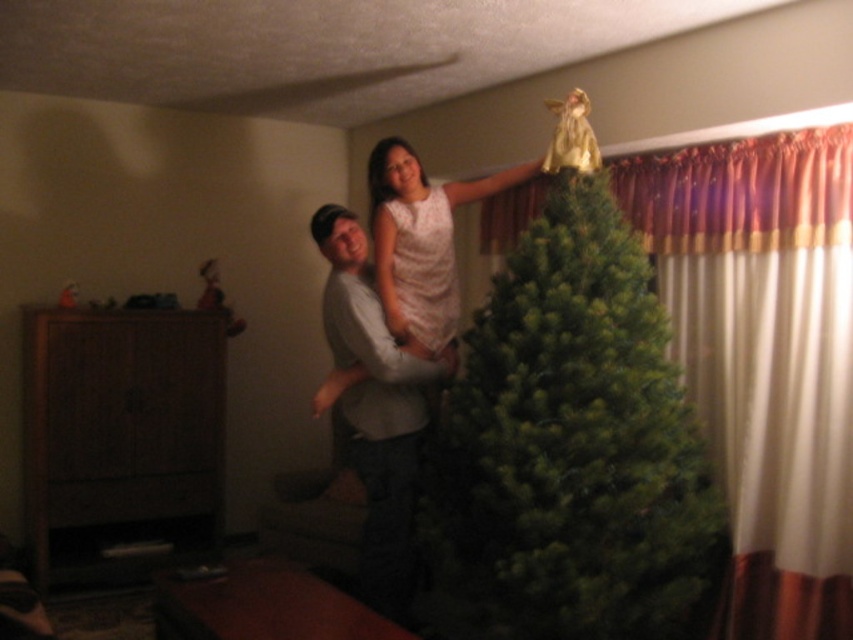
Question: Among these points, which one is nearest to the camera?

Choices:
 (A) (407, 230)
 (B) (367, 352)
 (C) (498, 317)

Answer: (B)

Question: Does gray cotton shirt at center have a greater width compared to white lace dress at center?

Choices:
 (A) no
 (B) yes

Answer: (A)

Question: Which point appears farthest from the camera in this image?

Choices:
 (A) (329, 316)
 (B) (381, 214)

Answer: (B)

Question: Does green matte christmas tree at center have a greater width compared to gray cotton shirt at center?

Choices:
 (A) yes
 (B) no

Answer: (A)

Question: Can you confirm if green matte christmas tree at center is positioned below gray cotton shirt at center?

Choices:
 (A) no
 (B) yes

Answer: (A)

Question: Which point is closer to the camera?

Choices:
 (A) (393, 488)
 (B) (531, 396)

Answer: (B)